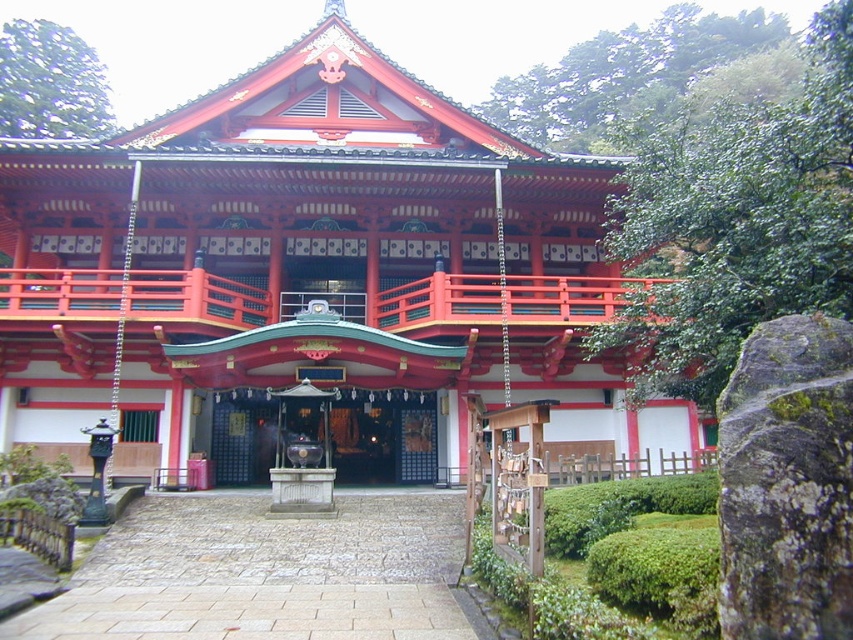
The width and height of the screenshot is (853, 640). Describe the element at coordinates (311, 266) in the screenshot. I see `shiny red wood temple at center` at that location.

Measure the distance between point (325, 260) and camera.

A distance of 61.10 feet exists between point (325, 260) and camera.

Find the location of `shiny red wood temple at center`. shiny red wood temple at center is located at coordinates (311, 266).